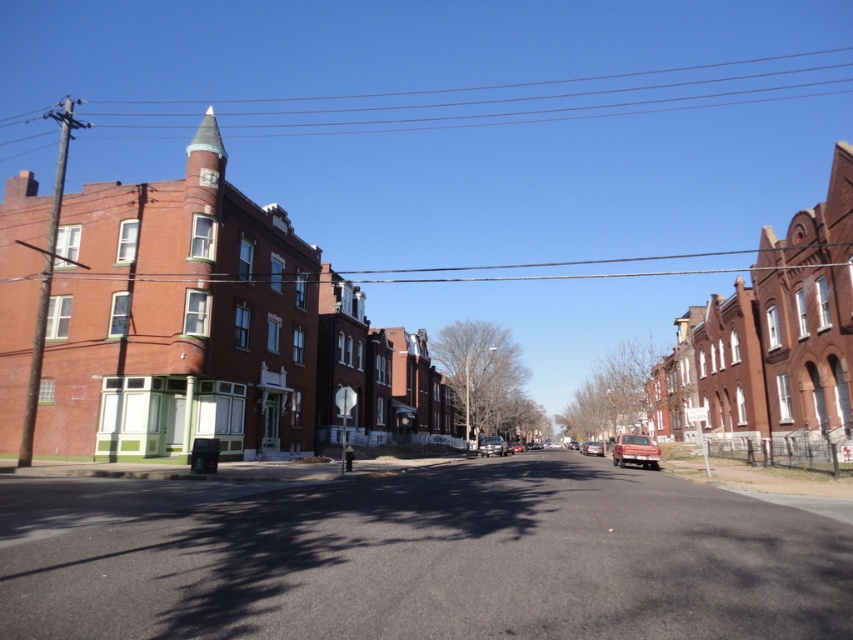
You are a delivery driver who needs to park your vehicle in a space that requires a height clearance of 1.6 meters. You see a matte red car at center and a shiny silver sedan at center. Which car would you choose to park in the space to ensure it meets the height requirement?

The matte red car at center is not as tall as shiny silver sedan at center, so the matte red car at center would be the better choice to park in the space since it is shorter and meets the 1.6 meters height clearance requirement.

You are a pedestrian standing on the sidewalk next to the street. You see a matte red car at center and a shiny silver sedan at center. Which car is closer to you?

The matte red car at center is closer to you because it is in front of the shiny silver sedan at center.

You are driving a car and see the shiny silver sedan at center and the metallic silver car at center in front of you. Which one is closer to the left side of the road?

The shiny silver sedan at center is closer to the left side of the road because it is positioned to the left of the metallic silver car at center.